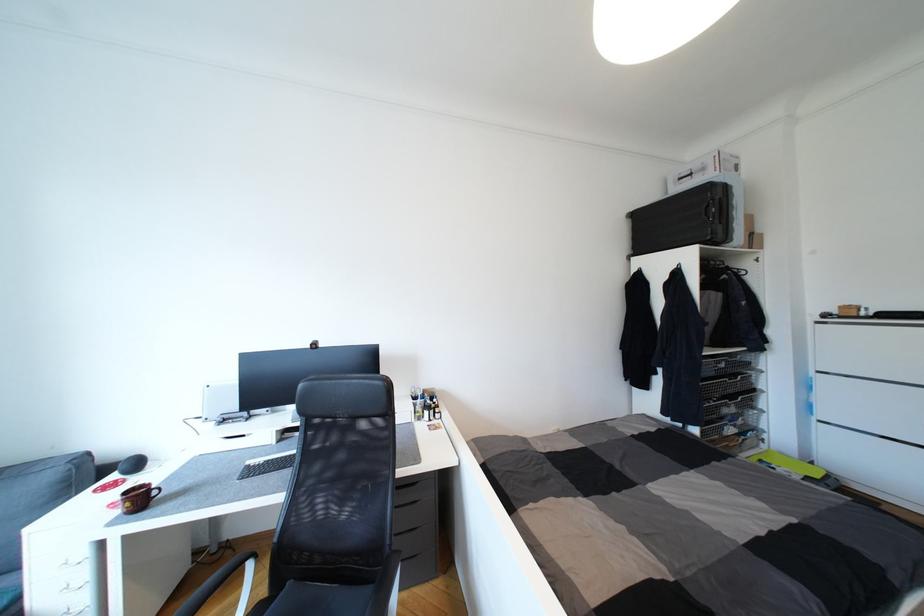
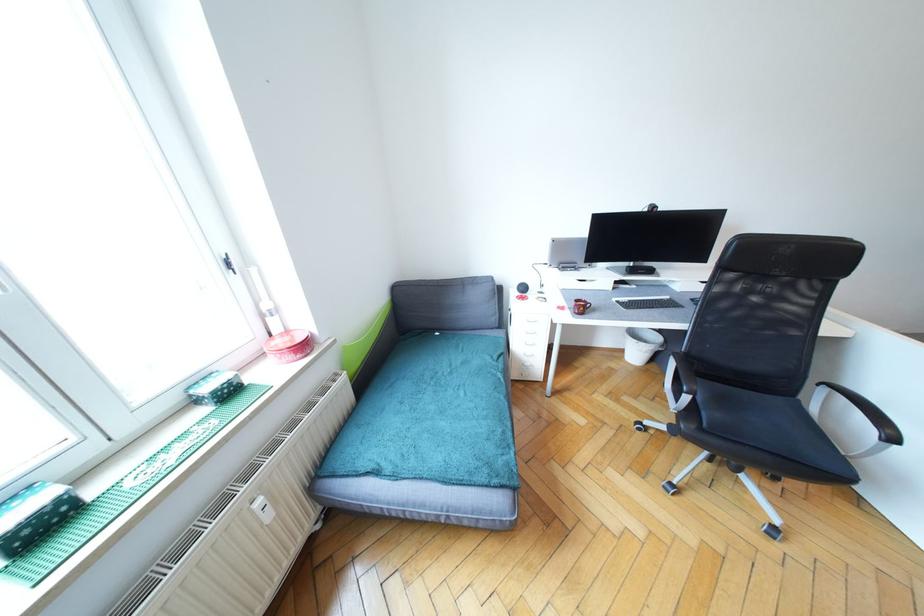
Locate, in the second image, the point that corresponds to the point at 150,488 in the first image.

(589, 302)